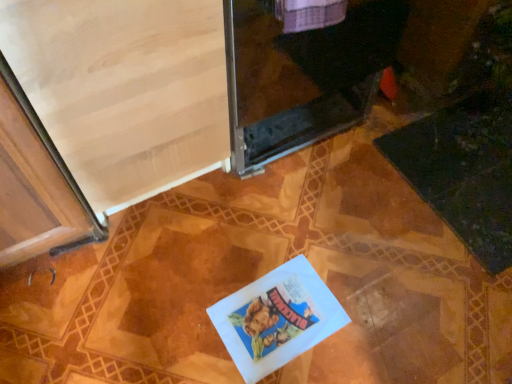
Locate an element on the screen. vacant space situated above white paper book at center (from a real-world perspective) is located at coordinates [278, 316].